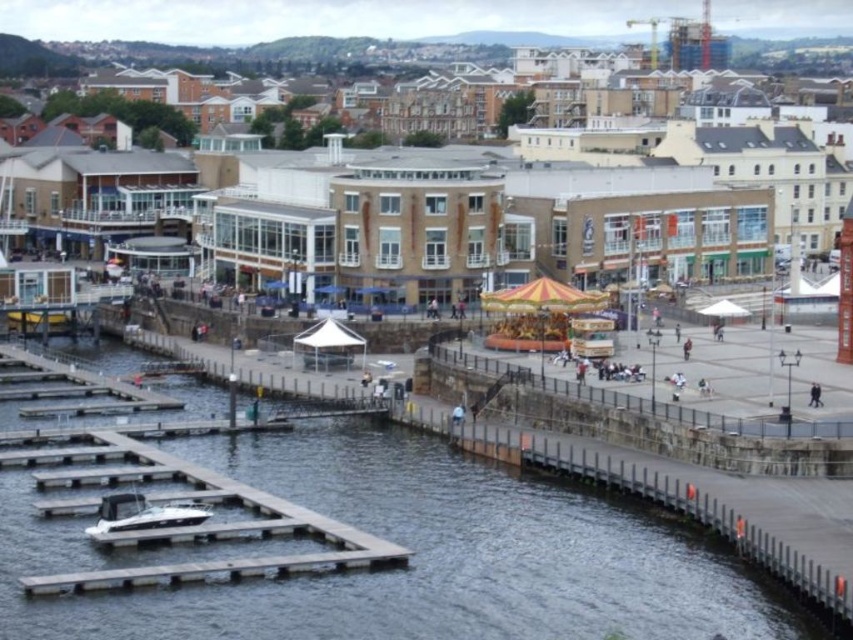
Question: Among these objects, which one is nearest to the camera?

Choices:
 (A) clear water at lower left
 (B) white matte dock at lower left
 (C) white glossy boat at lower left
 (D) orange striped tent at center

Answer: (A)

Question: Does white matte dock at lower left have a smaller size compared to white glossy boat at lower left?

Choices:
 (A) no
 (B) yes

Answer: (A)

Question: Estimate the real-world distances between objects in this image. Which object is closer to the white matte dock at lower left?

Choices:
 (A) white glossy boat at lower left
 (B) clear water at lower left

Answer: (B)

Question: Can you confirm if white matte dock at lower left is positioned below white glossy boat at lower left?

Choices:
 (A) no
 (B) yes

Answer: (A)

Question: Which of the following is the farthest from the observer?

Choices:
 (A) clear water at lower left
 (B) white glossy boat at lower left

Answer: (B)

Question: Can you confirm if orange striped tent at center is positioned above white matte dock at lower left?

Choices:
 (A) no
 (B) yes

Answer: (B)